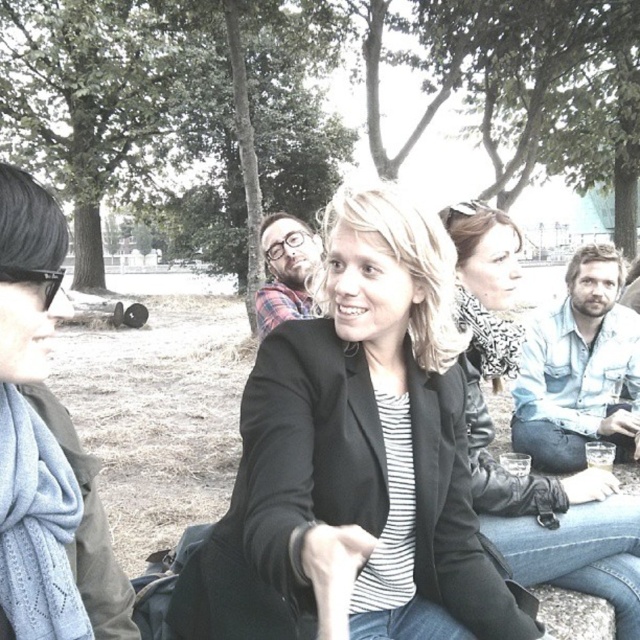
Question: Can you confirm if light blue scarf at center is positioned below light blue knitted scarf at left?

Choices:
 (A) yes
 (B) no

Answer: (A)

Question: Is black matte blazer at center further to camera compared to light blue knitted scarf at left?

Choices:
 (A) no
 (B) yes

Answer: (B)

Question: Observing the image, what is the correct spatial positioning of black matte blazer at center in reference to light blue knitted scarf at left?

Choices:
 (A) left
 (B) right

Answer: (B)

Question: Which object is farther from the camera taking this photo?

Choices:
 (A) light blue scarf at center
 (B) light blue knitted scarf at left
 (C) black matte blazer at center

Answer: (A)

Question: Which point appears farthest from the camera in this image?

Choices:
 (A) (276, 522)
 (B) (588, 592)
 (C) (52, 212)

Answer: (B)

Question: Which object is closer to the camera taking this photo?

Choices:
 (A) black matte blazer at center
 (B) light blue scarf at center
 (C) light blue knitted scarf at left

Answer: (C)